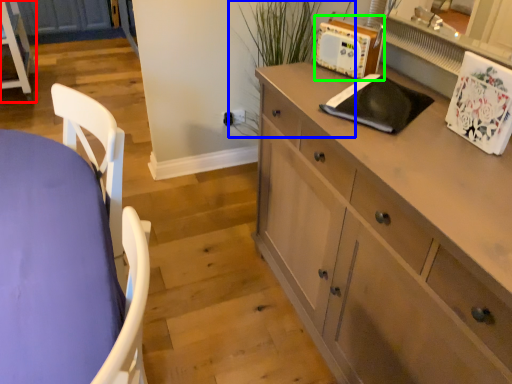
Question: Which is farther away from chest of drawers (highlighted by a red box)? plant (highlighted by a blue box) or appliance (highlighted by a green box)?

Choices:
 (A) plant
 (B) appliance

Answer: (B)